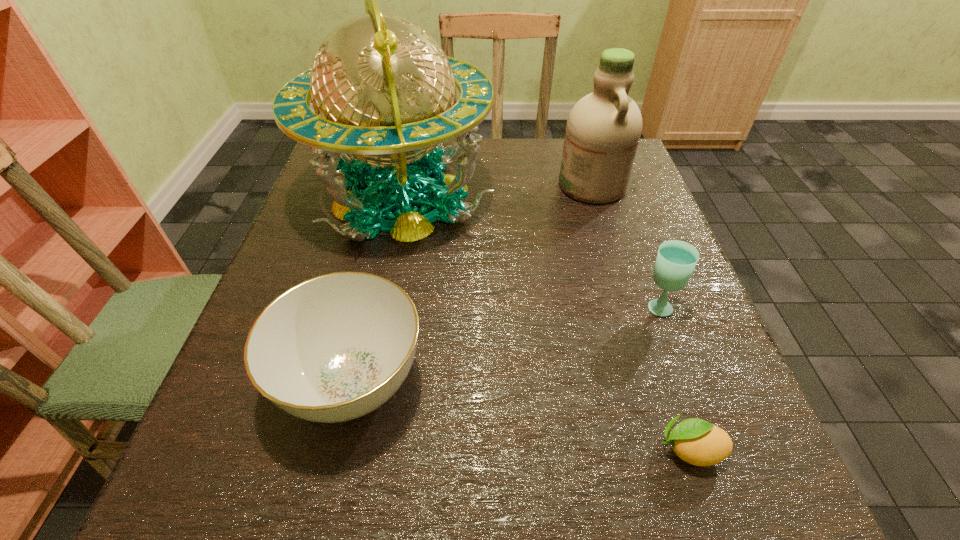
The width and height of the screenshot is (960, 540). Find the location of `vacant space that satisfies the following two spatial constraints: 1. on the back side of the chinaware; 2. on the right side of the tallest object`. vacant space that satisfies the following two spatial constraints: 1. on the back side of the chinaware; 2. on the right side of the tallest object is located at coordinates click(395, 198).

You are a GUI agent. You are given a task and a screenshot of the screen. Output one action in this format:
    pyautogui.click(x=<x>, y=<y>)
    Task: Click on the free space that satisfies the following two spatial constraints: 1. on the front label of the cleansing agent; 2. on the back side of the glass
    Image resolution: width=960 pixels, height=540 pixels.
    Given the screenshot: What is the action you would take?
    pyautogui.click(x=629, y=306)